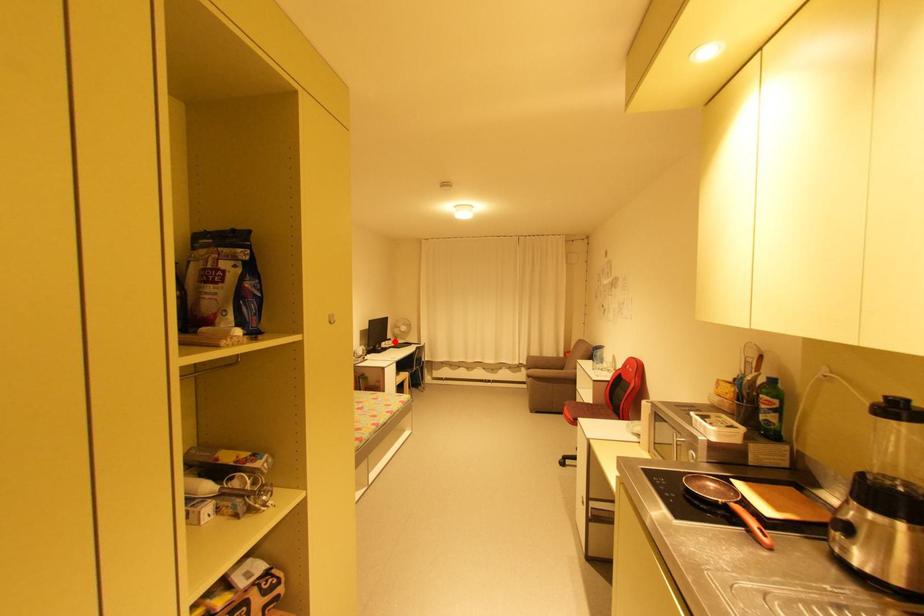
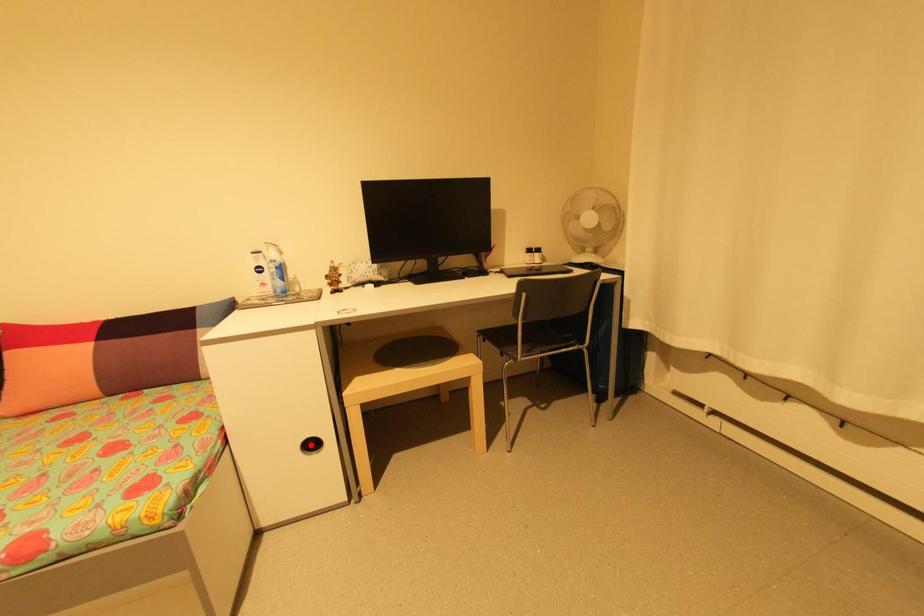
I am providing you with two images of the same scene from different viewpoints. A red point is marked on the first image and another point is marked on the second image. Is the red point in image1 aligned with the point shown in image2?

No